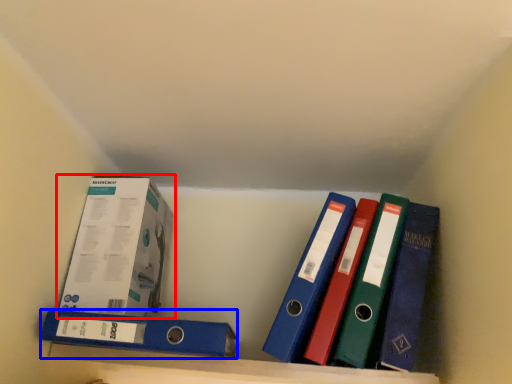
Question: Among these objects, which one is nearest to the camera, box (highlighted by a red box) or binder (highlighted by a blue box)?

Choices:
 (A) box
 (B) binder

Answer: (B)